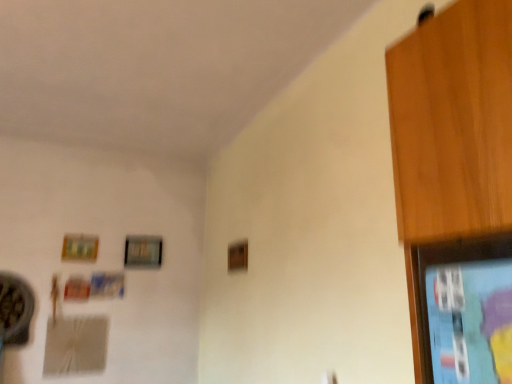
Question: Which direction should I rotate to look at wooden picture frame at upper center, the 2th picture frame in the left-to-right sequence?

Choices:
 (A) left
 (B) right

Answer: (A)

Question: Can you see wooden picture frame at upper left, acting as the 2th picture frame starting from the right, touching wooden picture frame at upper center, which is the second picture frame in front-to-back order?

Choices:
 (A) no
 (B) yes

Answer: (A)

Question: Considering the relative positions of wooden picture frame at upper left, which is the first picture frame from front to back, and wooden picture frame at upper center, the 1th picture frame in the right-to-left sequence, in the image provided, is wooden picture frame at upper left, which is the first picture frame from front to back, to the right of wooden picture frame at upper center, the 1th picture frame in the right-to-left sequence, from the viewer's perspective?

Choices:
 (A) yes
 (B) no

Answer: (B)

Question: Are wooden picture frame at upper left, which is the 1th picture frame from left to right, and wooden picture frame at upper center, the 2th picture frame in the left-to-right sequence, far apart?

Choices:
 (A) no
 (B) yes

Answer: (A)

Question: Is wooden picture frame at upper left, positioned as the 2th picture frame in back-to-front order, thinner than wooden picture frame at upper center, the 1th picture frame in the right-to-left sequence?

Choices:
 (A) yes
 (B) no

Answer: (A)

Question: Does wooden picture frame at upper left, acting as the 2th picture frame starting from the right, contain wooden picture frame at upper center, which is the second picture frame in front-to-back order?

Choices:
 (A) no
 (B) yes

Answer: (A)

Question: Does wooden picture frame at upper left, positioned as the 2th picture frame in back-to-front order, come in front of wooden picture frame at upper center, the 2th picture frame in the left-to-right sequence?

Choices:
 (A) no
 (B) yes

Answer: (B)

Question: Is wooden picture frame at upper center, which is the second picture frame in front-to-back order, shorter than wooden picture frame at upper left, which is the first picture frame from front to back?

Choices:
 (A) no
 (B) yes

Answer: (A)

Question: Is wooden picture frame at upper center, which is the second picture frame in front-to-back order, facing towards wooden picture frame at upper left, which is the 1th picture frame from left to right?

Choices:
 (A) no
 (B) yes

Answer: (A)

Question: Is wooden picture frame at upper center, the 2th picture frame in the left-to-right sequence, completely or partially outside of wooden picture frame at upper left, which is the first picture frame from front to back?

Choices:
 (A) no
 (B) yes

Answer: (B)

Question: Considering the relative sizes of wooden picture frame at upper center, arranged as the 1th picture frame when viewed from the back, and wooden picture frame at upper left, which is the first picture frame from front to back, in the image provided, is wooden picture frame at upper center, arranged as the 1th picture frame when viewed from the back, taller than wooden picture frame at upper left, which is the first picture frame from front to back,?

Choices:
 (A) no
 (B) yes

Answer: (B)

Question: Considering the relative positions of wooden picture frame at upper center, arranged as the 1th picture frame when viewed from the back, and wooden picture frame at upper left, which is the 1th picture frame from left to right, in the image provided, is wooden picture frame at upper center, arranged as the 1th picture frame when viewed from the back, to the right of wooden picture frame at upper left, which is the 1th picture frame from left to right, from the viewer's perspective?

Choices:
 (A) yes
 (B) no

Answer: (A)

Question: Does wooden picture frame at upper center, which is the second picture frame in front-to-back order, have a lesser width compared to wooden picture frame at upper left, which is the 1th picture frame from left to right?

Choices:
 (A) no
 (B) yes

Answer: (A)

Question: Considering the positions of wooden picture frame at upper center, the 1th picture frame in the right-to-left sequence, and wooden picture frame at upper left, acting as the 2th picture frame starting from the right, in the image, is wooden picture frame at upper center, the 1th picture frame in the right-to-left sequence, wider or thinner than wooden picture frame at upper left, acting as the 2th picture frame starting from the right,?

Choices:
 (A) wide
 (B) thin

Answer: (A)